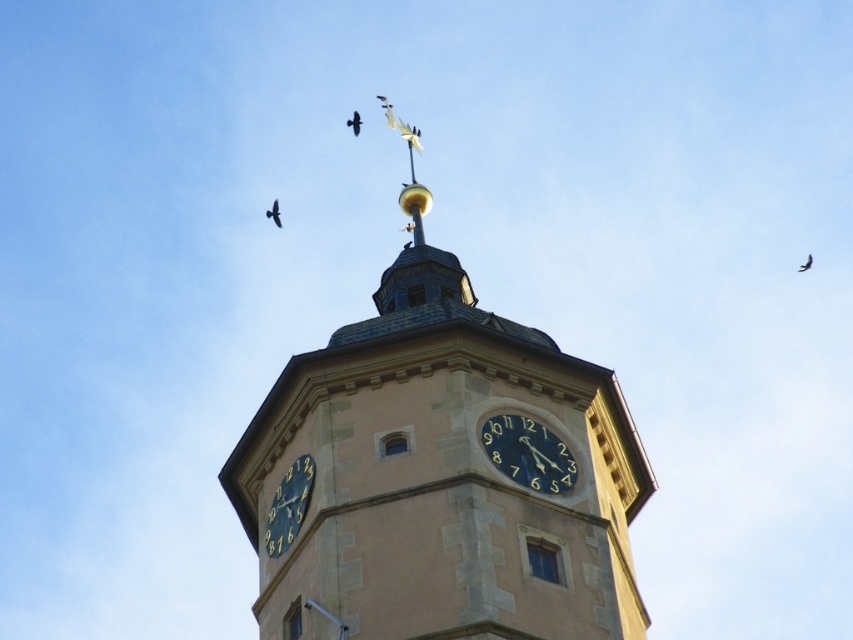
Between point (618, 520) and point (279, 513), which one is positioned in front?

Point (279, 513) is more forward.

Does point (437, 596) come farther from viewer compared to point (283, 518)?

No, (437, 596) is closer to viewer.

Where is `beige stone clock tower at center`? This screenshot has width=853, height=640. beige stone clock tower at center is located at coordinates (440, 472).

Does dark blue clock face at lower left appear under matte black bird at upper center?

Correct, dark blue clock face at lower left is located below matte black bird at upper center.

Is point (282, 486) closer to camera compared to point (381, 99)?

That is True.

Identify the location of dark blue clock face at lower left. The image size is (853, 640). [x=289, y=506].

Who is more forward, [273,200] or [358,132]?

Positioned in front is point [273,200].

Is brown feathered bird at upper left positioned at the back of dark brown feathered bird at upper center?

No.

Locate an element on the screen. The image size is (853, 640). brown feathered bird at upper left is located at coordinates (274, 212).